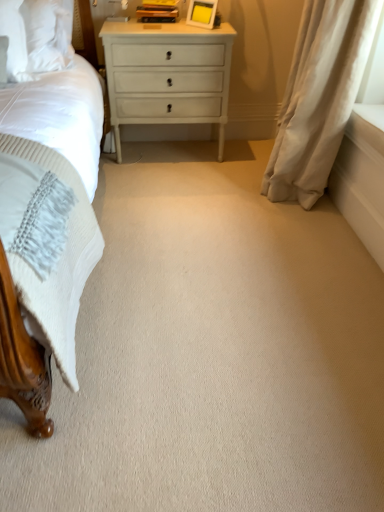
Question: Is white glossy nightstand at center located within white soft curtain at right?

Choices:
 (A) no
 (B) yes

Answer: (A)

Question: Can you confirm if white soft curtain at right is positioned to the left of white glossy nightstand at center?

Choices:
 (A) no
 (B) yes

Answer: (A)

Question: Can you confirm if white soft curtain at right is taller than white glossy nightstand at center?

Choices:
 (A) no
 (B) yes

Answer: (B)

Question: Are white soft curtain at right and white glossy nightstand at center located far from each other?

Choices:
 (A) yes
 (B) no

Answer: (B)

Question: Is the position of white soft curtain at right more distant than that of white glossy nightstand at center?

Choices:
 (A) yes
 (B) no

Answer: (B)

Question: From a real-world perspective, is white soft curtain at right positioned over white glossy nightstand at center based on gravity?

Choices:
 (A) yes
 (B) no

Answer: (A)

Question: Is white glossy nightstand at center behind white soft curtain at right?

Choices:
 (A) no
 (B) yes

Answer: (B)

Question: Is white soft curtain at right located within white glossy nightstand at center?

Choices:
 (A) yes
 (B) no

Answer: (B)

Question: Can you confirm if white glossy nightstand at center is thinner than white soft curtain at right?

Choices:
 (A) no
 (B) yes

Answer: (A)

Question: Is white glossy nightstand at center positioned before white soft curtain at right?

Choices:
 (A) no
 (B) yes

Answer: (A)

Question: Is white glossy nightstand at center facing away from white soft curtain at right?

Choices:
 (A) no
 (B) yes

Answer: (A)

Question: Does white glossy nightstand at center have a lesser height compared to white soft curtain at right?

Choices:
 (A) yes
 (B) no

Answer: (A)

Question: Considering their positions, is white glossy nightstand at center located in front of or behind white soft curtain at right?

Choices:
 (A) front
 (B) behind

Answer: (B)